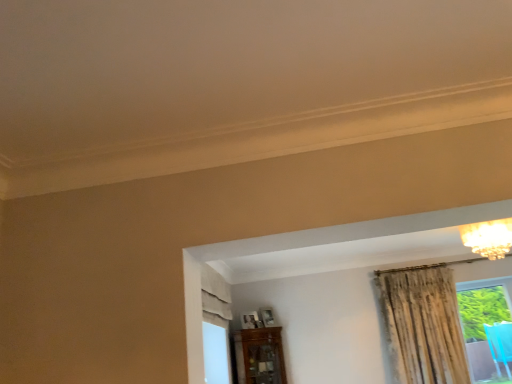
Describe the element at coordinates (488, 237) in the screenshot. I see `crystal chandelier at upper right` at that location.

Where is `crystal chandelier at upper right`? This screenshot has width=512, height=384. crystal chandelier at upper right is located at coordinates (488, 237).

Measure the distance between point (489,231) and camera.

They are 8.90 feet apart.

Identify the location of crystal chandelier at upper right. This screenshot has height=384, width=512. (488, 237).